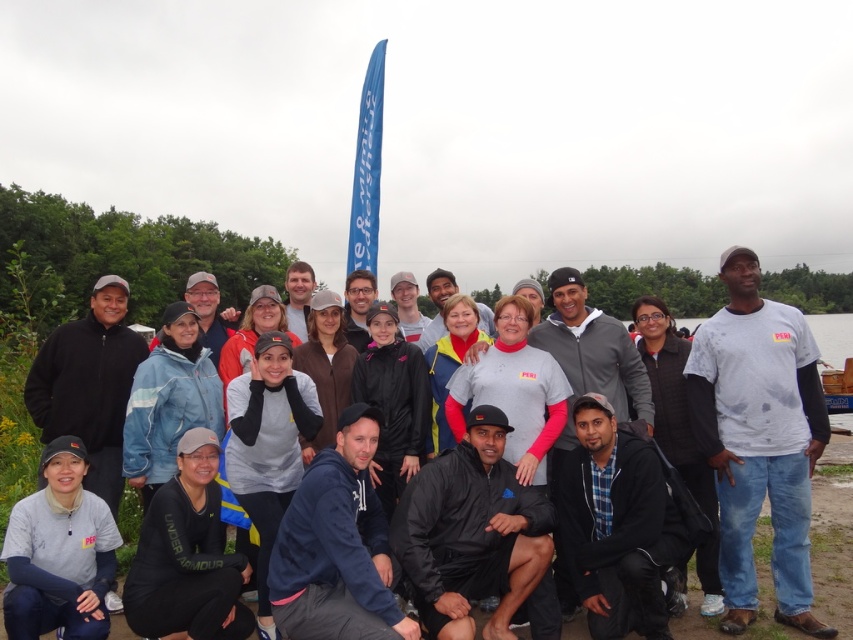
The image size is (853, 640). Describe the element at coordinates (471, 532) in the screenshot. I see `black matte jacket at center` at that location.

Between black matte jacket at center and black matte jacket at upper left, which one appears on the left side from the viewer's perspective?

black matte jacket at upper left

Measure the distance between black matte jacket at center and camera.

black matte jacket at center is 27.28 feet away from camera.

The width and height of the screenshot is (853, 640). Identify the location of black matte jacket at center. (471, 532).

Who is more distant from viewer, [646,536] or [213,328]?

The point [213,328] is behind.

Does plaid fabric shirt at lower center appear on the left side of light blue jacket at center?

No, plaid fabric shirt at lower center is not to the left of light blue jacket at center.

Identify the location of plaid fabric shirt at lower center. The image size is (853, 640). (616, 524).

Does black matte jacket at upper left have a greater height compared to gray hoodie at center?

No, black matte jacket at upper left is not taller than gray hoodie at center.

Is black matte jacket at upper left below gray hoodie at center?

Yes, black matte jacket at upper left is below gray hoodie at center.

Locate an element on the screen. black matte jacket at upper left is located at coordinates (90, 385).